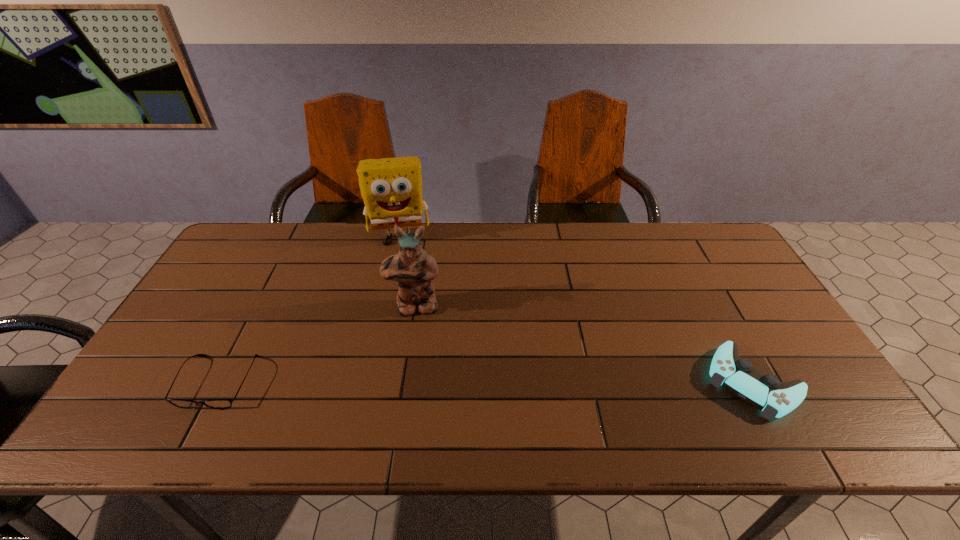
The width and height of the screenshot is (960, 540). Find the location of `unoccupied area between the control and the sponge`. unoccupied area between the control and the sponge is located at coordinates (576, 309).

This screenshot has height=540, width=960. I want to click on free spot between the control and the spectacles, so click(x=486, y=382).

This screenshot has height=540, width=960. In order to click on free spot between the figurine and the control in this screenshot , I will do `click(584, 345)`.

Locate an element on the screen. The width and height of the screenshot is (960, 540). object that is the third closest to the third nearest object is located at coordinates (765, 392).

Where is `object that is the closest to the sponge`? object that is the closest to the sponge is located at coordinates (413, 268).

At what (x,y) coordinates should I click in order to perform the action: click on vacant area in the image that satisfies the following two spatial constraints: 1. on the front side of the control; 2. on the left side of the figurine. Please return your answer as a coordinate pair (x, y). This screenshot has height=540, width=960. Looking at the image, I should click on pyautogui.click(x=403, y=382).

Find the location of a particular element. The height and width of the screenshot is (540, 960). free space that satisfies the following two spatial constraints: 1. on the front-facing side of the leftmost object; 2. on the left side of the second shortest object is located at coordinates (219, 382).